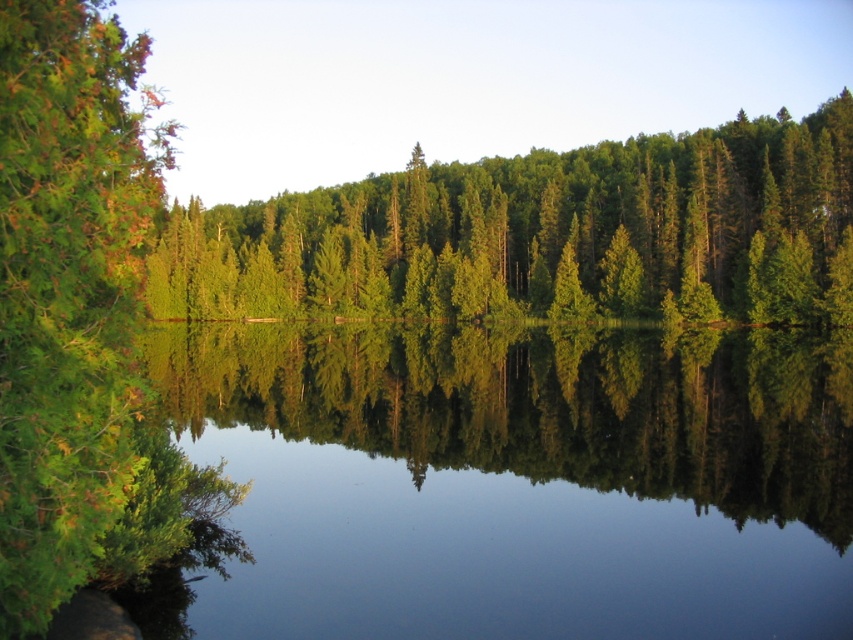
You are a kayaker planning to paddle from the clear water at center to the green matte tree at center. Given that your kayak can only handle calm waters up to 100 feet in distance, is this route feasible?

The distance between the clear water at center and the green matte tree at center is 102.09 feet, which exceeds the kayak route limit of 100 feet. Therefore, the route is not feasible.